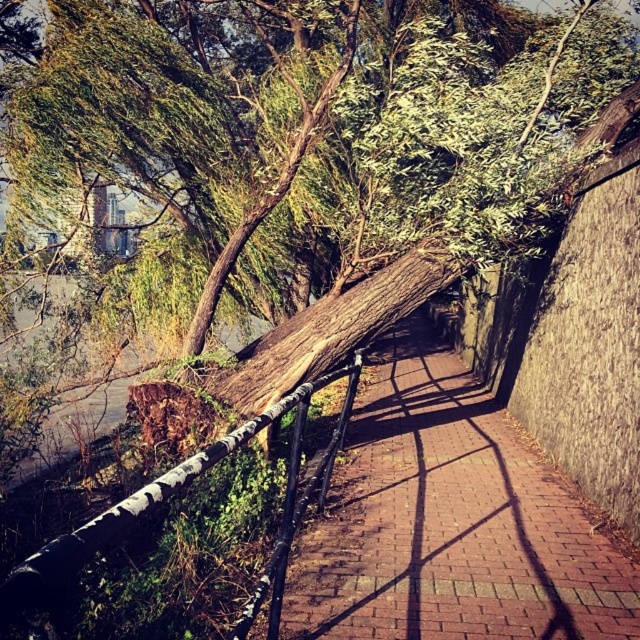
Question: Can you confirm if brick pavement at center is thinner than white painted metal rail at center?

Choices:
 (A) yes
 (B) no

Answer: (B)

Question: Can you confirm if brick pavement at center is bigger than white painted metal rail at center?

Choices:
 (A) no
 (B) yes

Answer: (B)

Question: Does brick pavement at center have a larger size compared to white painted metal rail at center?

Choices:
 (A) no
 (B) yes

Answer: (B)